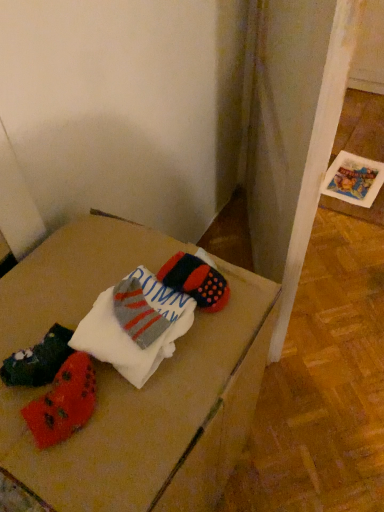
This screenshot has width=384, height=512. Describe the element at coordinates (158, 419) in the screenshot. I see `wooden table at center` at that location.

Image resolution: width=384 pixels, height=512 pixels. What are the coordinates of `wooden table at center` in the screenshot? It's located at (158, 419).

This screenshot has width=384, height=512. I want to click on white cotton socks at center, so click(x=135, y=325).

Describe the element at coordinates (135, 325) in the screenshot. I see `white cotton socks at center` at that location.

Where is `wooden table at center`? wooden table at center is located at coordinates (158, 419).

Is white cotton socks at center to the left of wooden table at center from the viewer's perspective?

In fact, white cotton socks at center is to the right of wooden table at center.

Who is more distant, white cotton socks at center or wooden table at center?

Positioned behind is white cotton socks at center.

Is point (135, 280) farther from camera compared to point (76, 451)?

Yes, point (135, 280) is behind point (76, 451).

From the image's perspective, does white cotton socks at center appear lower than wooden table at center?

Actually, white cotton socks at center appears above wooden table at center in the image.

From a real-world perspective, which is physically above, white cotton socks at center or wooden table at center?

white cotton socks at center.

Looking at their sizes, would you say white cotton socks at center is wider or thinner than wooden table at center?

white cotton socks at center is thinner than wooden table at center.

Does white cotton socks at center have a lesser height compared to wooden table at center?

Indeed, white cotton socks at center has a lesser height compared to wooden table at center.

Does white cotton socks at center have a smaller size compared to wooden table at center?

Correct, white cotton socks at center occupies less space than wooden table at center.

Is white cotton socks at center inside the boundaries of wooden table at center, or outside?

white cotton socks at center is contained in wooden table at center.

Are white cotton socks at center and wooden table at center beside each other?

No, white cotton socks at center is not with wooden table at center.

Is white cotton socks at center looking in the opposite direction of wooden table at center?

white cotton socks at center is not turned away from wooden table at center.

Consider the image. How different are the orientations of white cotton socks at center and wooden table at center in degrees?

white cotton socks at center and wooden table at center are facing 2.89 degrees away from each other.

The width and height of the screenshot is (384, 512). I want to click on furniture that is under the white cotton socks at center (from a real-world perspective), so click(158, 419).

Is wooden table at center to the left of white cotton socks at center from the viewer's perspective?

Yes, wooden table at center is to the left of white cotton socks at center.

Which object is closer to the camera, wooden table at center or white cotton socks at center?

wooden table at center is in front.

Does point (93, 268) come farther from viewer compared to point (112, 319)?

Yes, it is behind point (112, 319).

From the image's perspective, is wooden table at center positioned above or below white cotton socks at center?

wooden table at center is below white cotton socks at center.

From a real-world perspective, is wooden table at center physically above white cotton socks at center?

Incorrect, from a real-world perspective, wooden table at center is lower than white cotton socks at center.

Does wooden table at center have a greater width compared to white cotton socks at center?

Yes.

Is wooden table at center taller than white cotton socks at center?

Yes.

Based on their sizes in the image, would you say wooden table at center is bigger or smaller than white cotton socks at center?

Clearly, wooden table at center is larger in size than white cotton socks at center.

Choose the correct answer: Is wooden table at center inside white cotton socks at center or outside it?

The correct answer is: outside.

Consider the image. Is wooden table at center far away from white cotton socks at center?

No, there isn't a large distance between wooden table at center and white cotton socks at center.

Could you tell me if wooden table at center is turned towards white cotton socks at center?

No, wooden table at center is not aimed at white cotton socks at center.

How many degrees apart are the facing directions of wooden table at center and white cotton socks at center?

wooden table at center and white cotton socks at center are facing 2.89 degrees away from each other.

Where is `sheet behind the wooden table at center`? sheet behind the wooden table at center is located at coordinates (135, 325).

The width and height of the screenshot is (384, 512). Find the location of `furniture below the white cotton socks at center (from a real-world perspective)`. furniture below the white cotton socks at center (from a real-world perspective) is located at coordinates click(x=158, y=419).

Identify the location of sheet behind the wooden table at center. This screenshot has height=512, width=384. (135, 325).